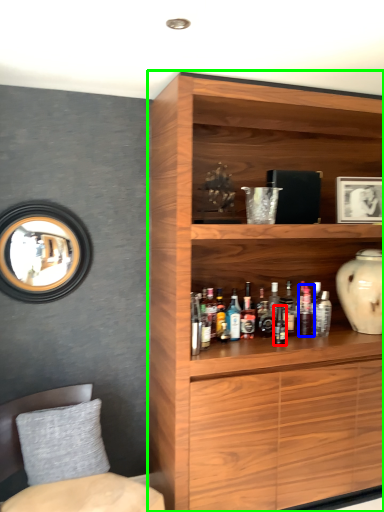
Question: Which object is positioned closest to bottle (highlighted by a red box)? Select from bottle (highlighted by a blue box) and cupboard (highlighted by a green box).

Choices:
 (A) bottle
 (B) cupboard

Answer: (A)